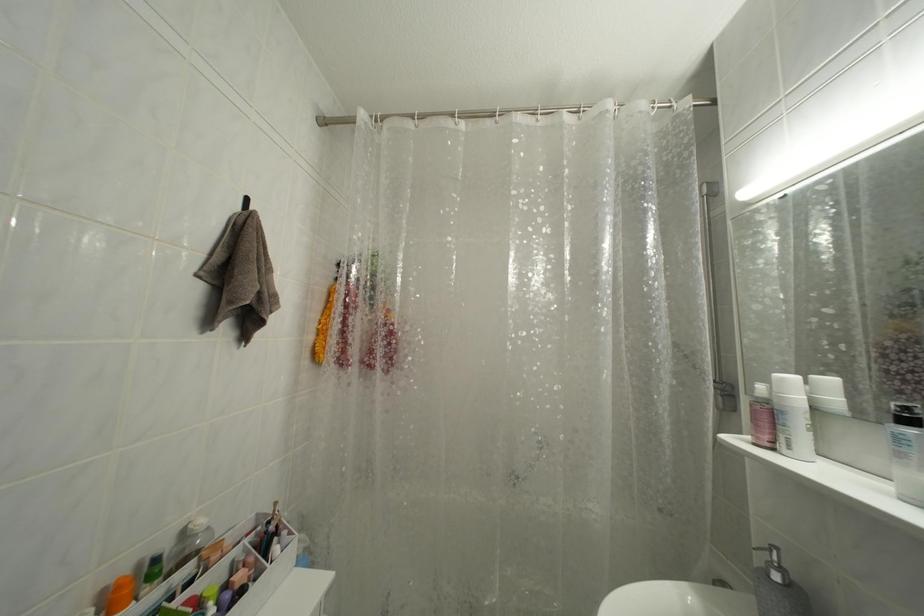
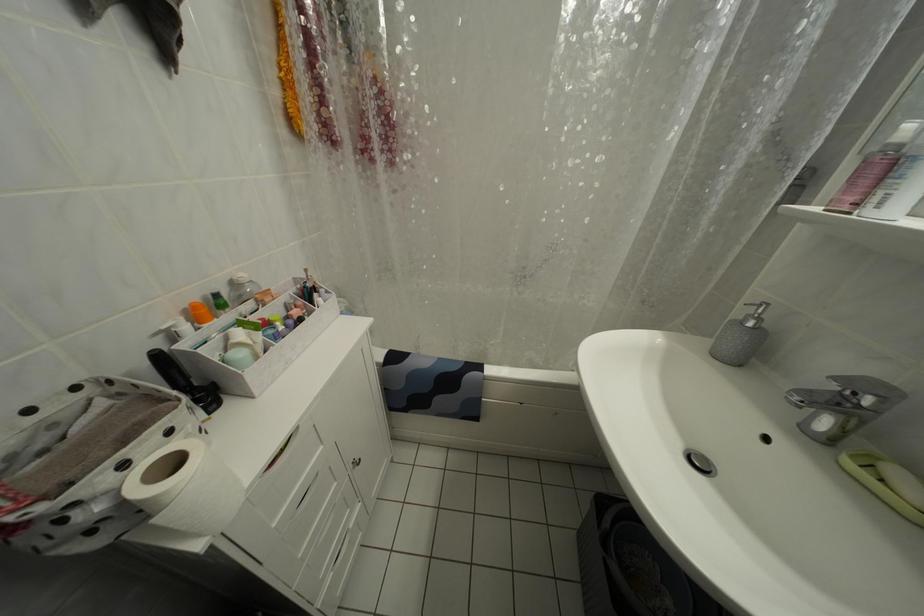
Question: How did the camera likely rotate?

Choices:
 (A) Left
 (B) Right
 (C) Up
 (D) Down

Answer: (D)